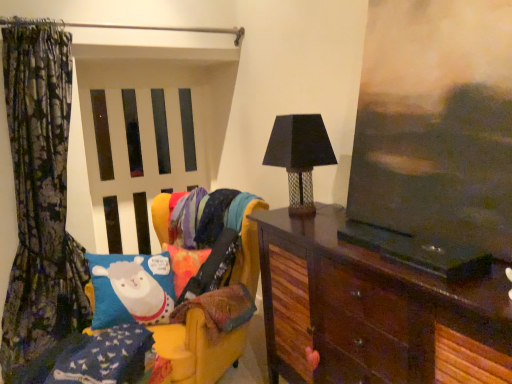
Question: Is floral fabric curtain at left wider or thinner than velvet yellow swivel chair at left?

Choices:
 (A) thin
 (B) wide

Answer: (A)

Question: From the image's perspective, is floral fabric curtain at left located above or below velvet yellow swivel chair at left?

Choices:
 (A) above
 (B) below

Answer: (A)

Question: Which of these objects is positioned closest to the dark wood cabinet at right?

Choices:
 (A) floral fabric curtain at left
 (B) black mesh table lamp at center right
 (C) white matte screen door at center
 (D) velvet yellow swivel chair at left

Answer: (B)

Question: Which object is positioned closest to the black mesh table lamp at center right?

Choices:
 (A) white matte screen door at center
 (B) velvet yellow swivel chair at left
 (C) floral fabric curtain at left
 (D) dark wood cabinet at right

Answer: (D)